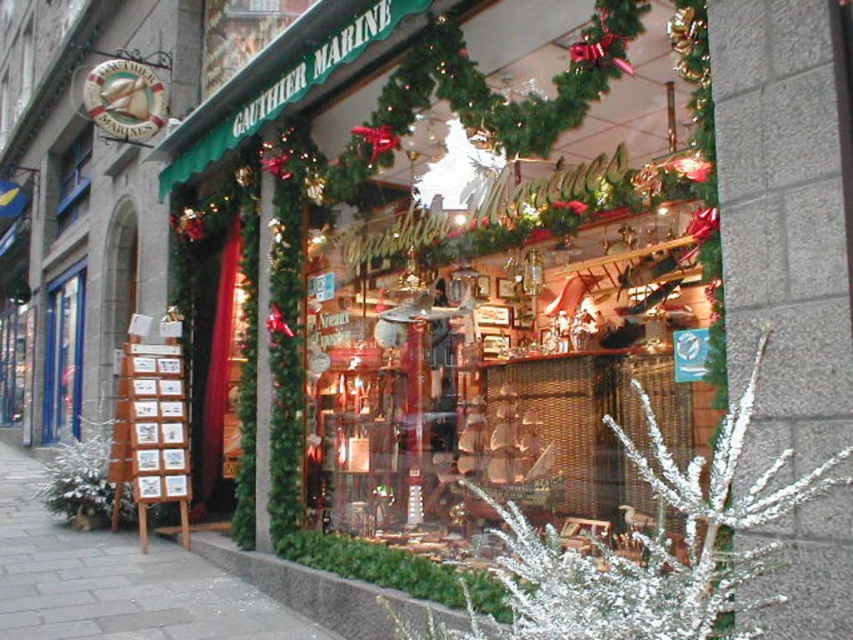
Question: Which point appears farthest from the camera in this image?

Choices:
 (A) (24, 556)
 (B) (80, 346)

Answer: (B)

Question: Is gray stone pavement at lower left smaller than blue glass door at left?

Choices:
 (A) no
 (B) yes

Answer: (B)

Question: In this image, where is gray stone pavement at lower left located relative to blue glass door at left?

Choices:
 (A) right
 (B) left

Answer: (A)

Question: From the image, what is the correct spatial relationship of gray stone pavement at lower left in relation to blue glass door at left?

Choices:
 (A) below
 (B) above

Answer: (A)